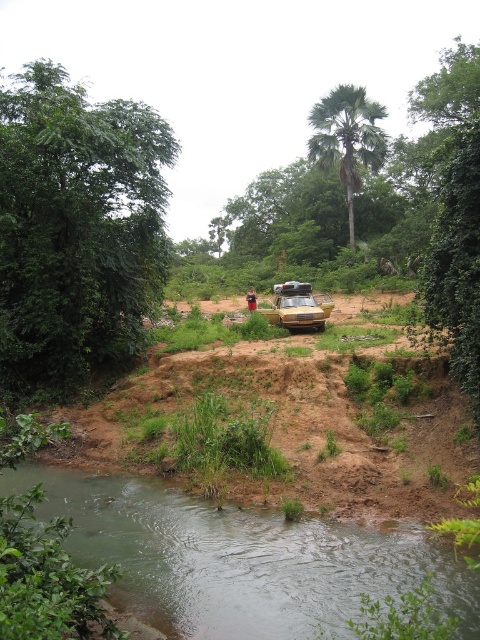
You are a hiker who wants to cross the river using a small wooden bridge that is 1.2 meters wide. The gold metallic car at center is parked at point (298,307). Can you safely cross the bridge if your backpack is 1.0 meters wide?

The small wooden bridge is 1.2 meters wide, and your backpack is 1.0 meters wide. Since the bridge is wider than your backpack, you can safely cross the bridge while carrying your backpack.

You are planning to cross the river using a small boat that can only carry items up to 2 meters wide. Based on the scene, can the green smooth water at lower center accommodate the boat if the boat is as wide as the green leafy palm tree at upper center?

The green smooth water at lower center is wider than the green leafy palm tree at upper center, so the boat, which is as wide as the palm tree, can fit within the water width.

You are a hiker who wants to cross the river using the path near the gold metallic car at center and the brown fabric person at center. Based on the scene, which object is closer to you, indicating the nearest point to start crossing?

The gold metallic car at center is closer to you than the brown fabric person at center, so you should start crossing near the gold metallic car at center.